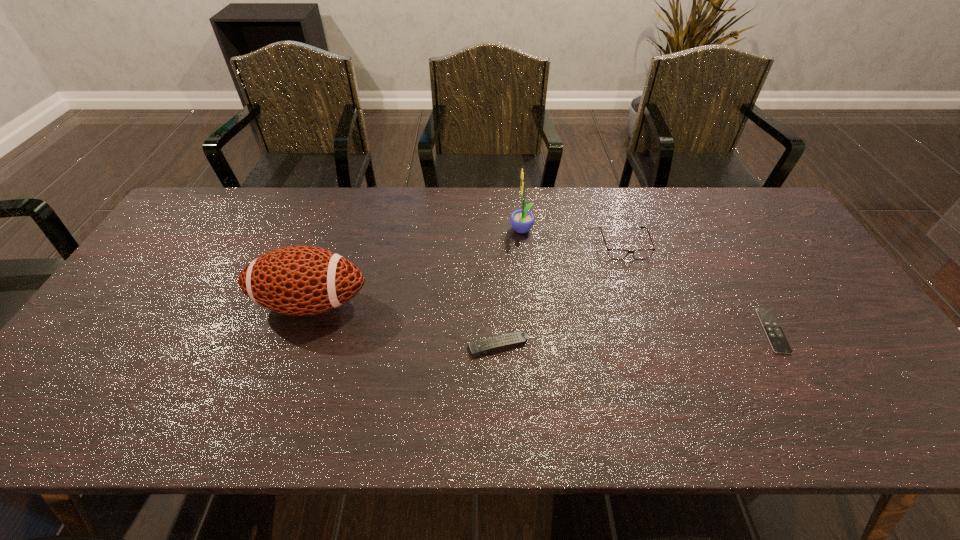
The height and width of the screenshot is (540, 960). What are the coordinates of `sunflower` in the screenshot? It's located at (522, 221).

Image resolution: width=960 pixels, height=540 pixels. I want to click on the leftmost object, so click(296, 280).

Locate an element on the screen. The height and width of the screenshot is (540, 960). the fourth shortest object is located at coordinates (296, 280).

The height and width of the screenshot is (540, 960). What are the coordinates of `the second object from right to left` in the screenshot? It's located at (618, 254).

This screenshot has height=540, width=960. Identify the location of spectacles. (618, 254).

The image size is (960, 540). Find the location of `the second shortest object`. the second shortest object is located at coordinates (481, 346).

At what (x,y) coordinates should I click in order to perform the action: click on the taller remote control. Please return your answer as a coordinate pair (x, y). The height and width of the screenshot is (540, 960). Looking at the image, I should click on (481, 346).

You are a GUI agent. You are given a task and a screenshot of the screen. Output one action in this format:
    pyautogui.click(x=<x>, y=<y>)
    Task: Click on the shortest object
    The height and width of the screenshot is (540, 960).
    Given the screenshot: What is the action you would take?
    pyautogui.click(x=778, y=342)

This screenshot has height=540, width=960. Find the location of `the rightmost object`. the rightmost object is located at coordinates (778, 342).

The height and width of the screenshot is (540, 960). I want to click on free region located on the front-facing side of the sunflower, so click(456, 231).